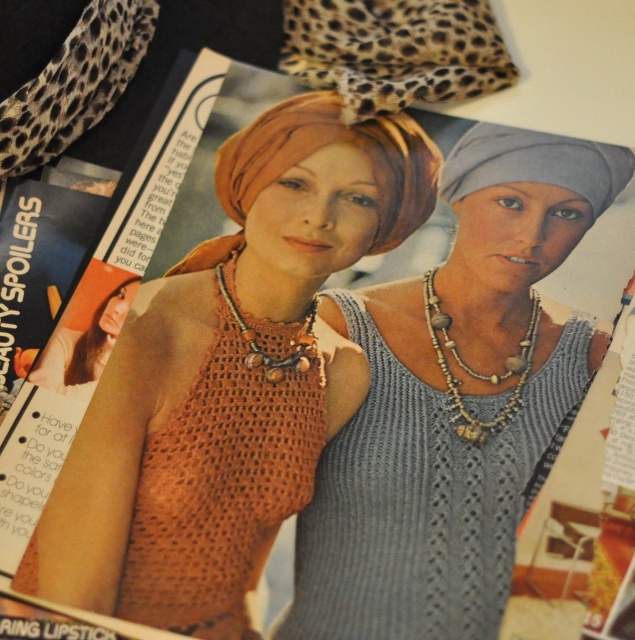
Question: Is wooden beads necklace at center above brown wooden beads necklace at center?

Choices:
 (A) no
 (B) yes

Answer: (A)

Question: Which object is positioned farthest from the knitted orange tank top at center?

Choices:
 (A) brown wooden beads necklace at center
 (B) wooden beads necklace at center

Answer: (A)

Question: Among these objects, which one is nearest to the camera?

Choices:
 (A) knitted orange tank top at center
 (B) brown wooden beads necklace at center
 (C) wooden beads necklace at center

Answer: (A)

Question: Observing the image, what is the correct spatial positioning of knitted orange tank top at center in reference to wooden beads necklace at center?

Choices:
 (A) right
 (B) left

Answer: (B)

Question: Estimate the real-world distances between objects in this image. Which object is closer to the crochet tank top at center?

Choices:
 (A) wooden beads necklace at center
 (B) brown wooden beads necklace at center
 (C) knitted orange tank top at center
 (D) orange knit tank top at lower left

Answer: (C)

Question: Does crochet tank top at center appear on the right side of knitted orange tank top at center?

Choices:
 (A) no
 (B) yes

Answer: (A)